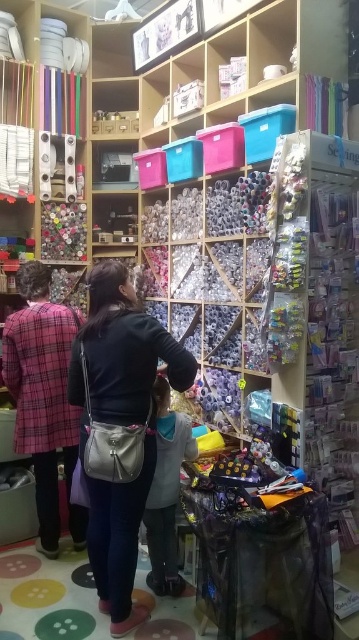
Which is more to the right, matte black purse at center or plaid fabric coat at left?

matte black purse at center

Does matte black purse at center have a greater width compared to plaid fabric coat at left?

Indeed, matte black purse at center has a greater width compared to plaid fabric coat at left.

Is point (123, 332) closer to camera compared to point (25, 342)?

Yes, it is.

This screenshot has width=359, height=640. What are the coordinates of `matte black purse at center` in the screenshot? It's located at (118, 428).